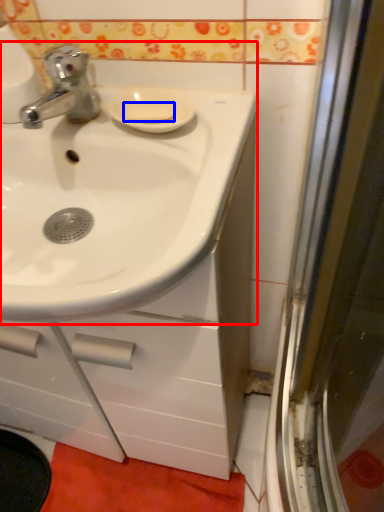
Question: Which point is further to the camera, sink (highlighted by a red box) or soap (highlighted by a blue box)?

Choices:
 (A) sink
 (B) soap

Answer: (B)